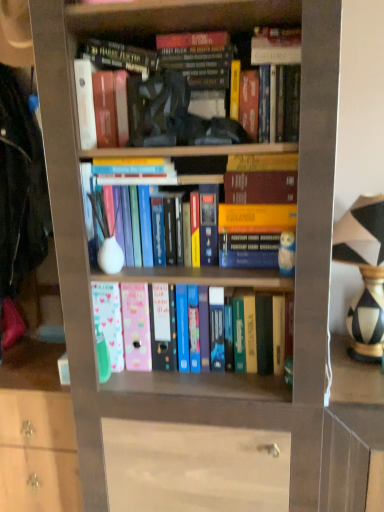
You are a GUI agent. You are given a task and a screenshot of the screen. Output one action in this format:
    pyautogui.click(x=<x>, y=<y>)
    Task: Click on the hardcover book at upper center, which appears as the 2th book when ordered from the bottom
    Image resolution: width=384 pixels, height=512 pixels.
    Given the screenshot: What is the action you would take?
    pyautogui.click(x=120, y=57)

Describe the element at coordinates (120, 57) in the screenshot. Image resolution: width=384 pixels, height=512 pixels. I see `hardcover book at upper center, which appears as the 2th book when ordered from the bottom` at that location.

The image size is (384, 512). What do you see at coordinates (261, 332) in the screenshot? I see `pastel matte file folders at center, placed as the first book when sorted from bottom to top` at bounding box center [261, 332].

Measure the distance between point [273,37] and camera.

The distance of point [273,37] from camera is 1.14 meters.

The height and width of the screenshot is (512, 384). I want to click on hardcover book at upper center, which is the 2th book from top to bottom, so click(x=120, y=57).

Is point (350, 307) farther from viewer compared to point (257, 314)?

Yes, point (350, 307) is farther from viewer.

Is black-and-white striped vase at right far away from pastel matte file folders at center, placed as the first book when sorted from bottom to top?

Actually, black-and-white striped vase at right and pastel matte file folders at center, placed as the first book when sorted from bottom to top, are a little close together.

Who is bigger, black-and-white striped vase at right or pastel matte file folders at center, arranged as the 3th book when viewed from the top?

black-and-white striped vase at right is bigger.

Which object is further away from the camera, pastel matte file folders at center, arranged as the 3th book when viewed from the top, or black-and-white striped vase at right?

Positioned behind is pastel matte file folders at center, arranged as the 3th book when viewed from the top.

Can you confirm if pastel matte file folders at center, placed as the first book when sorted from bottom to top, is positioned to the right of black-and-white striped vase at right?

No, pastel matte file folders at center, placed as the first book when sorted from bottom to top, is not to the right of black-and-white striped vase at right.

From a real-world perspective, is pastel matte file folders at center, arranged as the 3th book when viewed from the top, physically located above or below black-and-white striped vase at right?

From a real-world perspective, pastel matte file folders at center, arranged as the 3th book when viewed from the top, is physically below black-and-white striped vase at right.

Consider the image. Are pastel matte file folders at center, arranged as the 3th book when viewed from the top, and black-and-white striped vase at right far apart?

They are positioned close to each other.

Between black-and-white striped vase at right and hardcover book at upper center, which ranks as the third book in bottom-to-top order, which one appears on the left side from the viewer's perspective?

From the viewer's perspective, hardcover book at upper center, which ranks as the third book in bottom-to-top order, appears more on the left side.

Considering the points (366, 217) and (284, 51), which point is behind, point (366, 217) or point (284, 51)?

The point (366, 217) is behind.

In the image, is black-and-white striped vase at right positioned in front of or behind hardcover book at upper center, which is the 1th book in top-to-bottom order?

In the image, black-and-white striped vase at right appears in front of hardcover book at upper center, which is the 1th book in top-to-bottom order.

Who is shorter, black-and-white striped vase at right or hardcover book at upper center, which ranks as the third book in bottom-to-top order?

hardcover book at upper center, which ranks as the third book in bottom-to-top order, is shorter.

Is pastel matte file folders at center, placed as the first book when sorted from bottom to top, in front of or behind hardcover book at upper center, which is the 1th book in top-to-bottom order, in the image?

pastel matte file folders at center, placed as the first book when sorted from bottom to top, is positioned farther from the viewer than hardcover book at upper center, which is the 1th book in top-to-bottom order.

Is pastel matte file folders at center, arranged as the 3th book when viewed from the top, situated inside hardcover book at upper center, which is the 1th book in top-to-bottom order, or outside?

pastel matte file folders at center, arranged as the 3th book when viewed from the top, is outside hardcover book at upper center, which is the 1th book in top-to-bottom order.

Is pastel matte file folders at center, arranged as the 3th book when viewed from the top, bigger or smaller than hardcover book at upper center, which is the 1th book in top-to-bottom order?

Considering their sizes, pastel matte file folders at center, arranged as the 3th book when viewed from the top, takes up more space than hardcover book at upper center, which is the 1th book in top-to-bottom order.

Can you tell me how much hardcover book at upper center, which appears as the 2th book when ordered from the bottom, and black-and-white striped vase at right differ in facing direction?

0.618 degrees separate the facing orientations of hardcover book at upper center, which appears as the 2th book when ordered from the bottom, and black-and-white striped vase at right.

Is hardcover book at upper center, which appears as the 2th book when ordered from the bottom, to the left or to the right of black-and-white striped vase at right in the image?

Clearly, hardcover book at upper center, which appears as the 2th book when ordered from the bottom, is on the left of black-and-white striped vase at right in the image.

Is the depth of hardcover book at upper center, which appears as the 2th book when ordered from the bottom, greater than that of black-and-white striped vase at right?

Yes, hardcover book at upper center, which appears as the 2th book when ordered from the bottom, is behind black-and-white striped vase at right.

Does pastel matte file folders at center, placed as the first book when sorted from bottom to top, have a greater width compared to hardcover book at upper center, which is the 2th book from top to bottom?

Yes, pastel matte file folders at center, placed as the first book when sorted from bottom to top, is wider than hardcover book at upper center, which is the 2th book from top to bottom.

Is pastel matte file folders at center, placed as the first book when sorted from bottom to top, far from hardcover book at upper center, which appears as the 2th book when ordered from the bottom?

No.

I want to click on book behind the hardcover book at upper center, which appears as the 2th book when ordered from the bottom, so click(261, 332).

Can you tell me how much pastel matte file folders at center, arranged as the 3th book when viewed from the top, and hardcover book at upper center, which appears as the 2th book when ordered from the bottom, differ in facing direction?

The facing directions of pastel matte file folders at center, arranged as the 3th book when viewed from the top, and hardcover book at upper center, which appears as the 2th book when ordered from the bottom, are 0.0034 degrees apart.

How much distance is there between hardcover book at upper center, which is the 1th book in top-to-bottom order, and hardcover book at upper center, which appears as the 2th book when ordered from the bottom?

hardcover book at upper center, which is the 1th book in top-to-bottom order, and hardcover book at upper center, which appears as the 2th book when ordered from the bottom, are 34.05 centimeters apart.

Is hardcover book at upper center, which is the 1th book in top-to-bottom order, to the right of hardcover book at upper center, which appears as the 2th book when ordered from the bottom, from the viewer's perspective?

Yes.

Who is taller, hardcover book at upper center, which ranks as the third book in bottom-to-top order, or hardcover book at upper center, which appears as the 2th book when ordered from the bottom?

hardcover book at upper center, which ranks as the third book in bottom-to-top order.

Who is bigger, hardcover book at upper center, which is the 1th book in top-to-bottom order, or hardcover book at upper center, which is the 2th book from top to bottom?

hardcover book at upper center, which is the 2th book from top to bottom, is bigger.

I want to click on table lamp positioned vertically above the pastel matte file folders at center, arranged as the 3th book when viewed from the top (from a real-world perspective), so click(364, 273).

At what (x,y) coordinates should I click in order to perform the action: click on table lamp lying above the pastel matte file folders at center, placed as the first book when sorted from bottom to top (from the image's perspective). Please return your answer as a coordinate pair (x, y). Looking at the image, I should click on (364, 273).

Which object lies further to the anchor point pastel matte file folders at center, placed as the first book when sorted from bottom to top, hardcover book at upper center, which is the 2th book from top to bottom, or black-and-white striped vase at right?

The object further to pastel matte file folders at center, placed as the first book when sorted from bottom to top, is hardcover book at upper center, which is the 2th book from top to bottom.

Which object lies further to the anchor point black-and-white striped vase at right, hardcover book at upper center, which is the 1th book in top-to-bottom order, or hardcover book at upper center, which is the 2th book from top to bottom?

Among the two, hardcover book at upper center, which is the 2th book from top to bottom, is located further to black-and-white striped vase at right.

Considering their positions, is hardcover book at upper center, which ranks as the third book in bottom-to-top order, positioned closer to pastel matte file folders at center, placed as the first book when sorted from bottom to top, than black-and-white striped vase at right?

black-and-white striped vase at right.

Estimate the real-world distances between objects in this image. Which object is closer to hardcover book at upper center, which appears as the 2th book when ordered from the bottom, black-and-white striped vase at right or hardcover book at upper center, which is the 1th book in top-to-bottom order?

The object closer to hardcover book at upper center, which appears as the 2th book when ordered from the bottom, is hardcover book at upper center, which is the 1th book in top-to-bottom order.

Considering their positions, is black-and-white striped vase at right positioned further to pastel matte file folders at center, arranged as the 3th book when viewed from the top, than hardcover book at upper center, which ranks as the third book in bottom-to-top order?

hardcover book at upper center, which ranks as the third book in bottom-to-top order, is positioned further to the anchor pastel matte file folders at center, arranged as the 3th book when viewed from the top.

Estimate the real-world distances between objects in this image. Which object is closer to hardcover book at upper center, which is the 2th book from top to bottom, hardcover book at upper center, which is the 1th book in top-to-bottom order, or black-and-white striped vase at right?

Based on the image, hardcover book at upper center, which is the 1th book in top-to-bottom order, appears to be nearer to hardcover book at upper center, which is the 2th book from top to bottom.

Estimate the real-world distances between objects in this image. Which object is closer to hardcover book at upper center, which appears as the 2th book when ordered from the bottom, black-and-white striped vase at right or pastel matte file folders at center, placed as the first book when sorted from bottom to top?

The object closer to hardcover book at upper center, which appears as the 2th book when ordered from the bottom, is pastel matte file folders at center, placed as the first book when sorted from bottom to top.

Based on their spatial positions, is hardcover book at upper center, which is the 2th book from top to bottom, or pastel matte file folders at center, placed as the first book when sorted from bottom to top, further from black-and-white striped vase at right?

hardcover book at upper center, which is the 2th book from top to bottom, is further to black-and-white striped vase at right.

In order to click on book between hardcover book at upper center, which is the 1th book in top-to-bottom order, and pastel matte file folders at center, placed as the first book when sorted from bottom to top, vertically in this screenshot , I will do `click(120, 57)`.

I want to click on table lamp between hardcover book at upper center, which ranks as the third book in bottom-to-top order, and pastel matte file folders at center, arranged as the 3th book when viewed from the top, vertically, so click(x=364, y=273).

Locate an element on the screen. Image resolution: width=384 pixels, height=512 pixels. table lamp between hardcover book at upper center, which is the 2th book from top to bottom, and pastel matte file folders at center, arranged as the 3th book when viewed from the top, vertically is located at coordinates (364, 273).